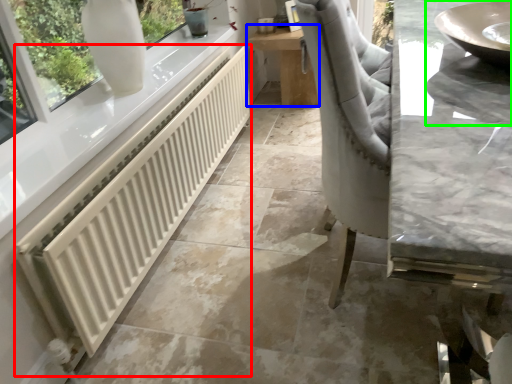
Question: Which is nearer to the radiator (highlighted by a red box)? table (highlighted by a blue box) or sink (highlighted by a green box).

Choices:
 (A) table
 (B) sink

Answer: (B)